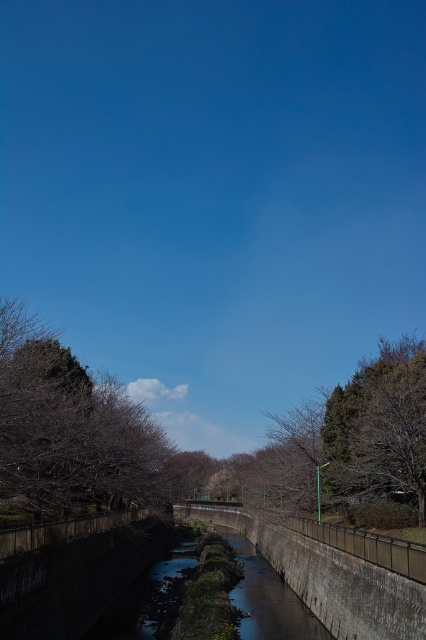
Question: Is brown leafless branches at upper left below clear water at center?

Choices:
 (A) no
 (B) yes

Answer: (A)

Question: Which object is the farthest from the green metallic pole at center-right?

Choices:
 (A) clear water at center
 (B) brown leafless branches at upper left

Answer: (B)

Question: Which of the following is the closest to the observer?

Choices:
 (A) (325, 422)
 (B) (160, 460)
 (C) (316, 625)

Answer: (C)

Question: Is green metallic pole at center-right below clear water at center?

Choices:
 (A) no
 (B) yes

Answer: (A)

Question: Which of the following is the farthest from the observer?

Choices:
 (A) clear water at center
 (B) green metallic pole at center-right
 (C) brown leafless branches at upper left

Answer: (B)

Question: Is brown leafless branches at upper left below green metallic pole at center-right?

Choices:
 (A) no
 (B) yes

Answer: (A)